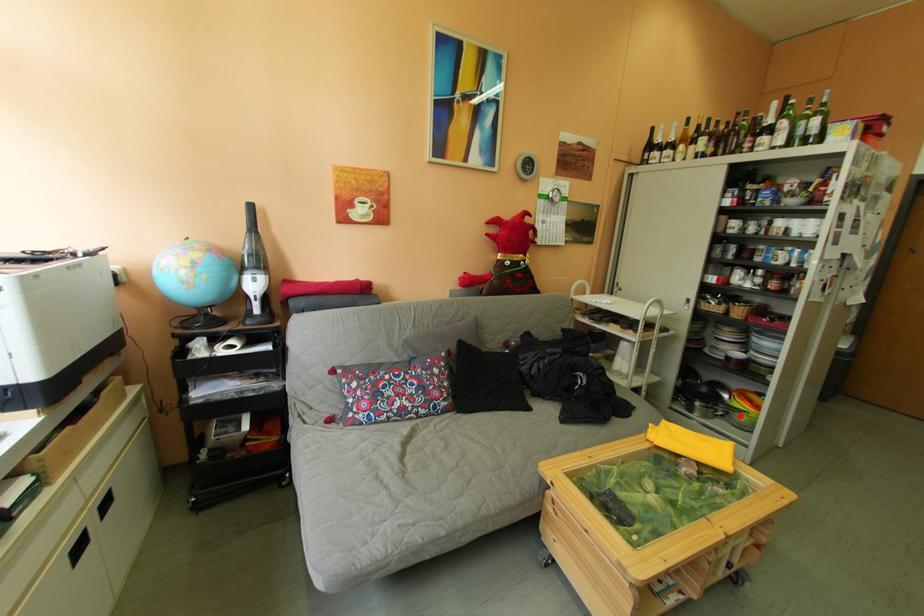
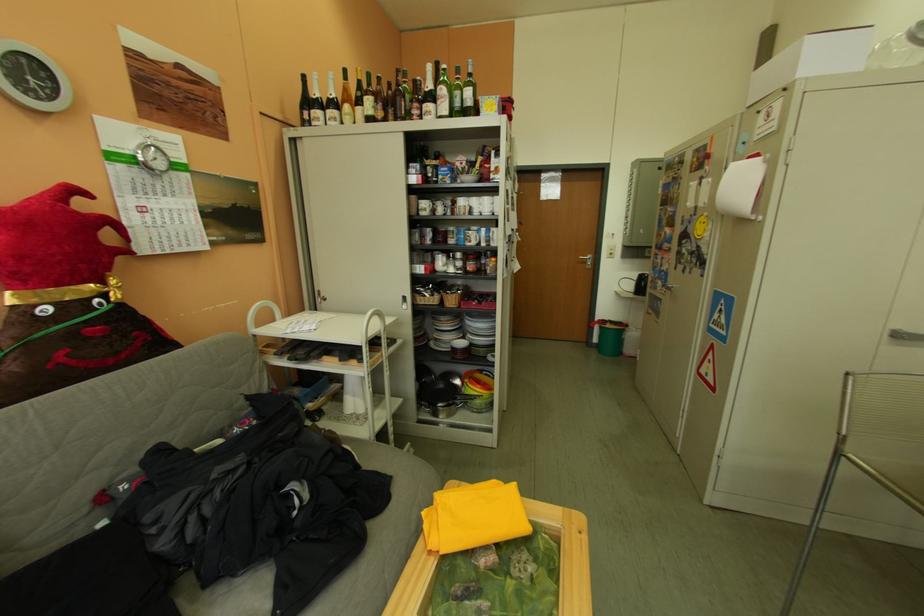
The point at the highlighted location is marked in the first image. Where is the corresponding point in the second image?

(478, 405)